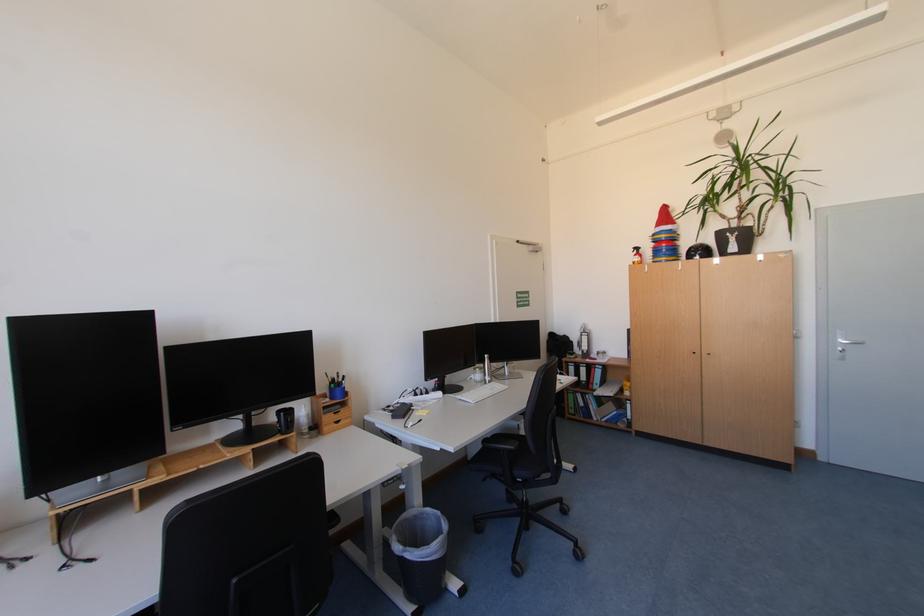
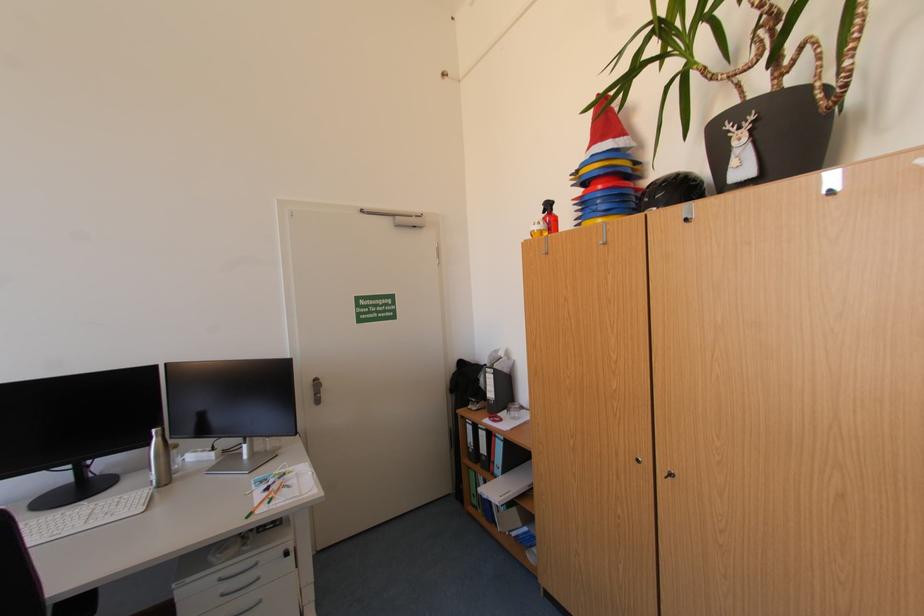
Locate, in the second image, the point that corresponds to the point at 672,252 in the first image.

(606, 203)